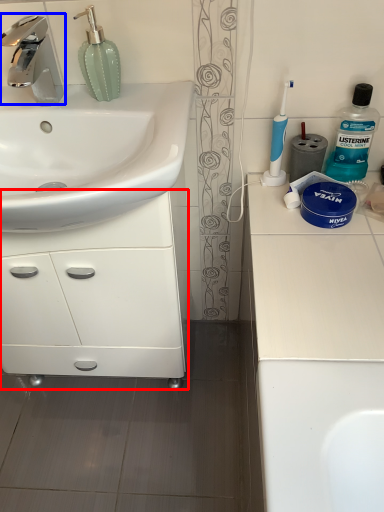
Question: Among these objects, which one is farthest to the camera, bathroom cabinet (highlighted by a red box) or tap (highlighted by a blue box)?

Choices:
 (A) bathroom cabinet
 (B) tap

Answer: (A)